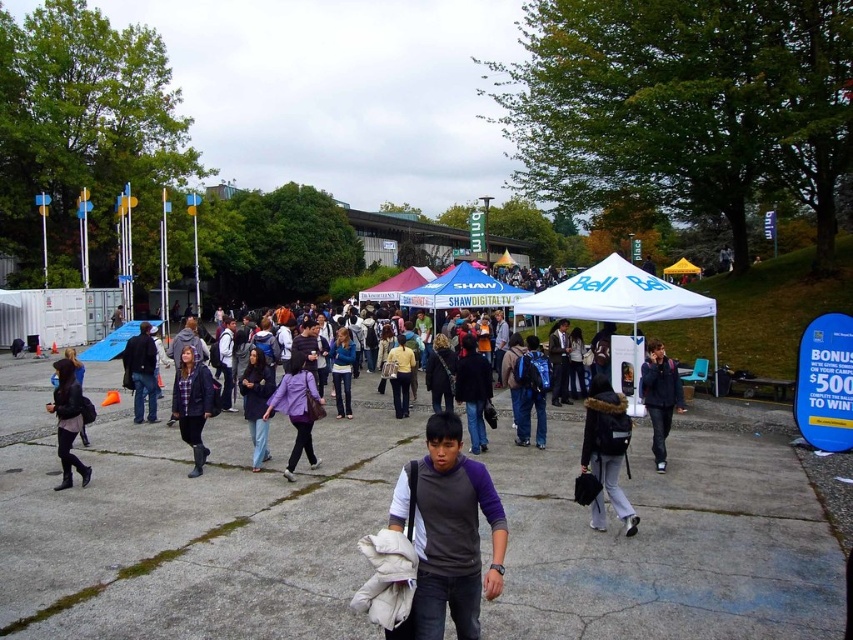
You are standing at the outdoor event and want to know which of the two points, point (x=607, y=273) or point (x=593, y=474), is closer to you. Can you determine this based on their positions?

Point (x=607, y=273) is closer to you because it is further to the viewer than point (x=593, y=474).

You are standing at the position of the young man in the purple shirt and need to reach a point marked by coordinates. Which of the two points, point (618, 438) or point (405, 387), is closer to you?

Point (618, 438) is closer to the camera than point (405, 387), so the point closer to you is point (618, 438).

You are a photographer standing at the edge of the event area. You want to take a photo of the dark gray fleece jacket at center and the yellow matte shirt at center so that both are fully visible in the frame. Considering their heights, which object should you focus on to ensure both are captured without cropping?

The dark gray fleece jacket at center is shorter than the yellow matte shirt at center. To ensure both are fully visible, focus on the yellow matte shirt at center as it is taller, allowing the shorter jacket to be captured within the frame.